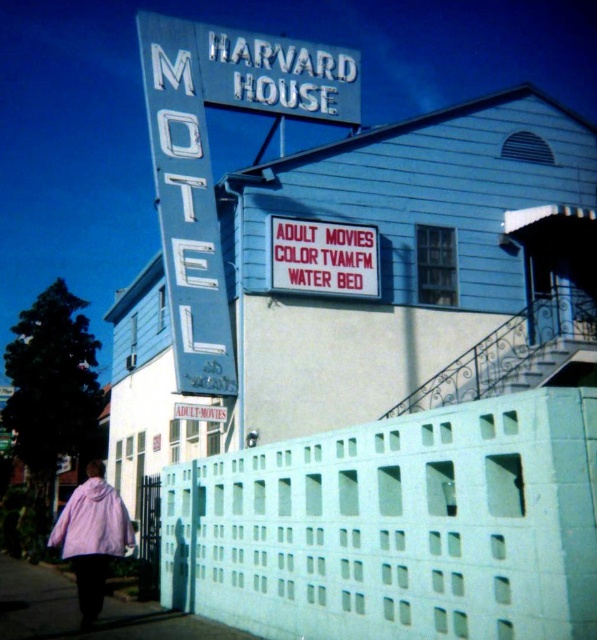
Question: Can you confirm if light blue concrete fence at lower center is thinner than smooth concrete pavement at lower left?

Choices:
 (A) no
 (B) yes

Answer: (B)

Question: Which point appears farthest from the camera in this image?

Choices:
 (A) (300, 100)
 (B) (66, 552)

Answer: (A)

Question: Which point is closer to the camera taking this photo?

Choices:
 (A) (147, 54)
 (B) (290, 228)
 (C) (66, 554)

Answer: (C)

Question: Does smooth concrete pavement at lower left appear under pink fuzzy coat at lower left?

Choices:
 (A) yes
 (B) no

Answer: (A)

Question: Where is smooth concrete pavement at lower left located in relation to pink fuzzy coat at lower left in the image?

Choices:
 (A) above
 (B) below

Answer: (B)

Question: Which point appears farthest from the camera in this image?

Choices:
 (A) (346, 228)
 (B) (38, 632)
 (C) (48, 538)

Answer: (C)